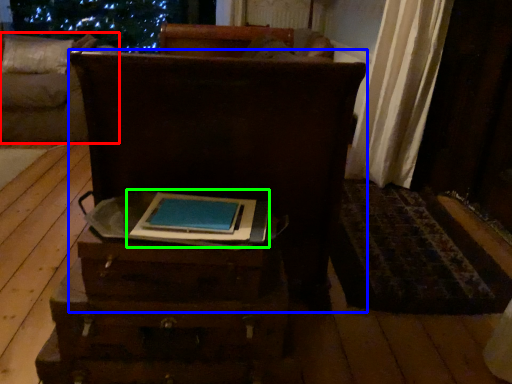
Question: Based on their relative distances, which object is farther from furniture (highlighted by a red box)? Choose from furniture (highlighted by a blue box) and book (highlighted by a green box).

Choices:
 (A) furniture
 (B) book

Answer: (B)